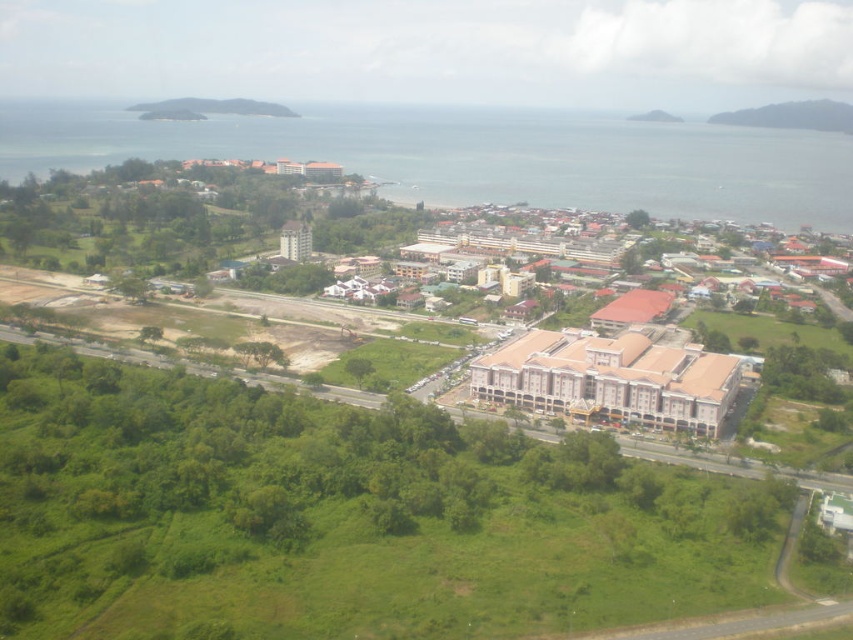
Is green grass at bottom left bigger than brown/brick building at center?

Actually, green grass at bottom left might be smaller than brown/brick building at center.

Between point (772, 195) and point (730, 388), which one is positioned behind?

Point (772, 195)

From the picture: Who is more distant from viewer, (599, 144) or (827, 243)?

The point (827, 243) is behind.

Locate an element on the screen. This screenshot has width=853, height=640. green grass at bottom left is located at coordinates (479, 156).

Can you confirm if green grass at bottom left is shorter than green grassy hillside at upper right?

Incorrect, green grass at bottom left's height does not fall short of green grassy hillside at upper right's.

Does green grass at bottom left appear under green grassy hillside at upper right?

Correct, green grass at bottom left is located below green grassy hillside at upper right.

Is point (538, 132) positioned before point (787, 116)?

Yes.

Where is `green grass at bottom left`? green grass at bottom left is located at coordinates (479, 156).

Is point (779, 112) positioned after point (264, 112)?

That is True.

Is the position of green grassy hillside at upper right more distant than that of green grassy hillside at upper left?

Yes, green grassy hillside at upper right is behind green grassy hillside at upper left.

You are a GUI agent. You are given a task and a screenshot of the screen. Output one action in this format:
    pyautogui.click(x=<x>, y=<y>)
    Task: Click on the green grassy hillside at upper right
    
    Given the screenshot: What is the action you would take?
    pyautogui.click(x=792, y=115)